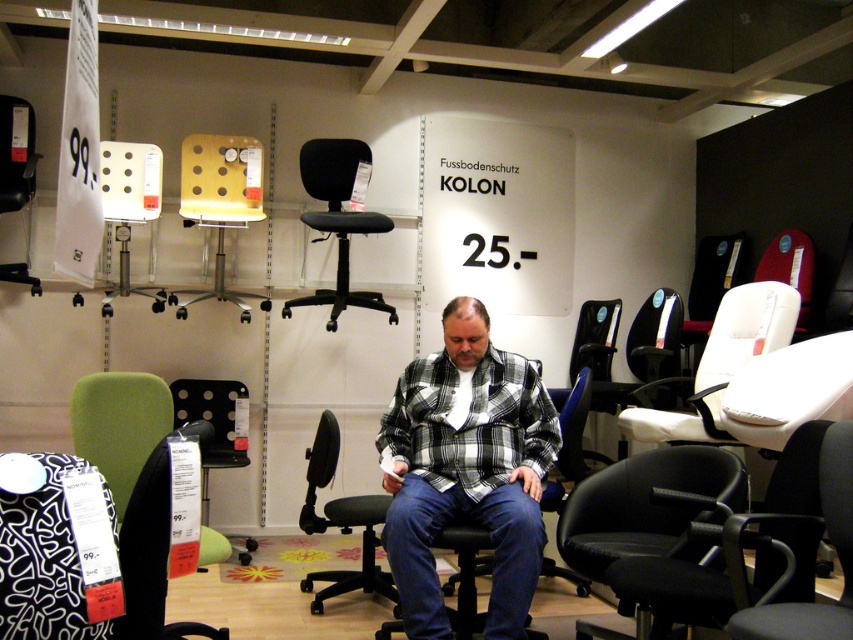
You are a customer in the furniture store and want to find the plaid shirt at center. Where should you look relative to the green fabric armchair at lower left?

The plaid shirt at center is located below the green fabric armchair at lower left, so you should look downward from the green fabric armchair at lower left to find it.

You are standing in the furniture store and want to find the green fabric armchair at lower left. According to the store layout, where should you look relative to your current position?

The green fabric armchair at lower left is located at point (119, 424), so you should look towards the lower left direction from your current position to find it.

You are an office worker who needs to choose between the green fabric armchair at lower left and the black fabric office chair at center for a small home office. Which chair would you recommend based on space constraints?

The green fabric armchair at lower left has a lesser width compared to the black fabric office chair at center, so it would be more suitable for a small home office due to its smaller size.